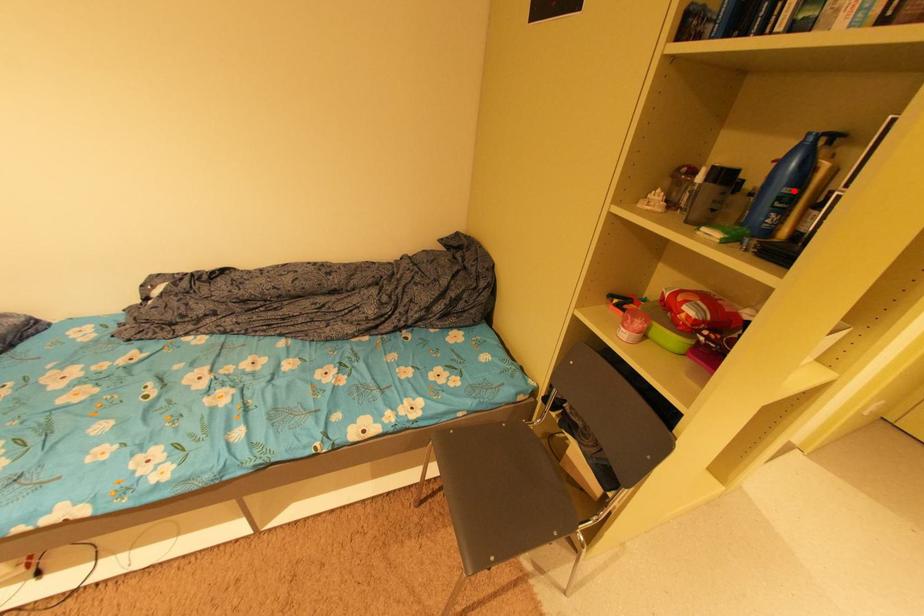
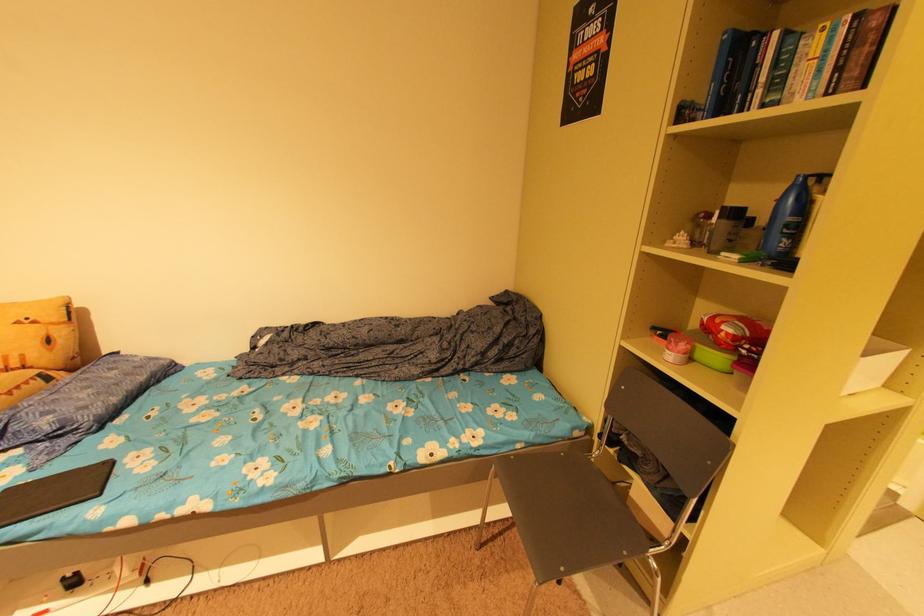
Locate, in the second image, the point that corresponds to the highlighted location in the first image.

(797, 220)